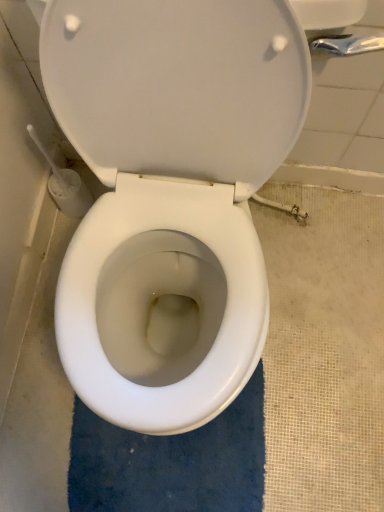
Question: In terms of height, does white glossy toilet at center look taller or shorter compared to blue plush bath mat at center?

Choices:
 (A) short
 (B) tall

Answer: (B)

Question: Does point (178, 110) appear closer or farther from the camera than point (165, 445)?

Choices:
 (A) farther
 (B) closer

Answer: (B)

Question: From a real-world perspective, is white glossy toilet at center physically located above or below blue plush bath mat at center?

Choices:
 (A) above
 (B) below

Answer: (A)

Question: Is point (127, 475) positioned closer to the camera than point (114, 26)?

Choices:
 (A) closer
 (B) farther

Answer: (B)

Question: Relative to white glossy toilet at center, is blue plush bath mat at center in front or behind?

Choices:
 (A) front
 (B) behind

Answer: (B)

Question: Looking at the image, does blue plush bath mat at center seem bigger or smaller compared to white glossy toilet at center?

Choices:
 (A) small
 (B) big

Answer: (A)

Question: From a real-world perspective, relative to white glossy toilet at center, is blue plush bath mat at center vertically above or below?

Choices:
 (A) above
 (B) below

Answer: (B)